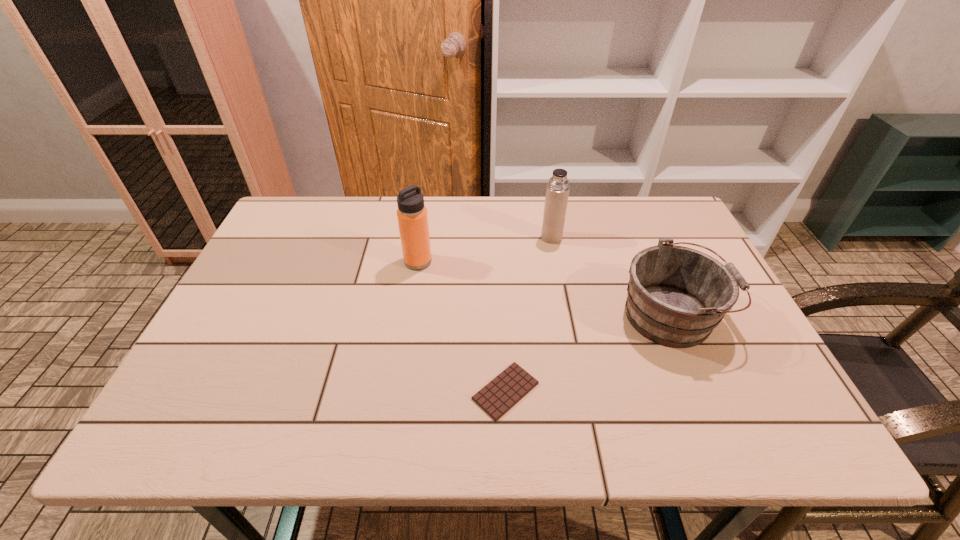
Locate an element on the screen. This screenshot has height=540, width=960. vacant region between the third object from left to right and the wine bucket is located at coordinates (612, 276).

Identify the location of object that stands as the third closest to the left thermos bottle. (676, 296).

Select which object appears as the third closest to the third tallest object. Please provide its 2D coordinates. Your answer should be formatted as a tuple, i.e. [(x, y)], where the tuple contains the x and y coordinates of a point satisfying the conditions above.

[(412, 217)]

You are a GUI agent. You are given a task and a screenshot of the screen. Output one action in this format:
    pyautogui.click(x=<x>, y=<y>)
    Task: Click on the vacant space that satisfies the following two spatial constraints: 1. on the front side of the leftmost object; 2. on the left side of the chocolate bar
    This screenshot has width=960, height=540.
    Given the screenshot: What is the action you would take?
    pyautogui.click(x=397, y=391)

The height and width of the screenshot is (540, 960). I want to click on vacant area in the image that satisfies the following two spatial constraints: 1. on the front side of the chocolate bar; 2. on the right side of the leftmost object, so click(x=397, y=391).